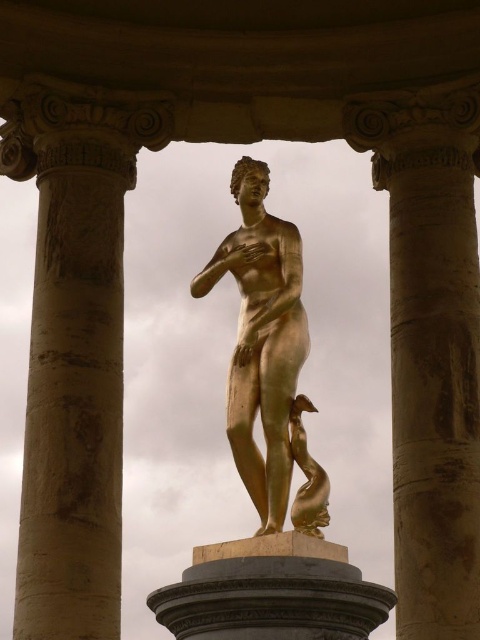
Question: Based on their relative distances, which object is nearer to the golden polished stone column at center?

Choices:
 (A) beige stone column at left
 (B) gold metallic statue at center
 (C) gold polished statue at center

Answer: (C)

Question: Can you confirm if beige stone column at left is positioned above gold polished statue at center?

Choices:
 (A) yes
 (B) no

Answer: (B)

Question: Which point is closer to the camera?

Choices:
 (A) (207, 273)
 (B) (292, 444)
 (C) (50, 266)

Answer: (B)

Question: Is beige stone column at left to the right of gold polished statue at center from the viewer's perspective?

Choices:
 (A) yes
 (B) no

Answer: (B)

Question: Does golden polished stone column at center appear under gold polished statue at center?

Choices:
 (A) yes
 (B) no

Answer: (A)

Question: Estimate the real-world distances between objects in this image. Which object is farther from the golden polished stone column at center?

Choices:
 (A) gold metallic statue at center
 (B) beige stone column at left
 (C) gold polished statue at center

Answer: (A)